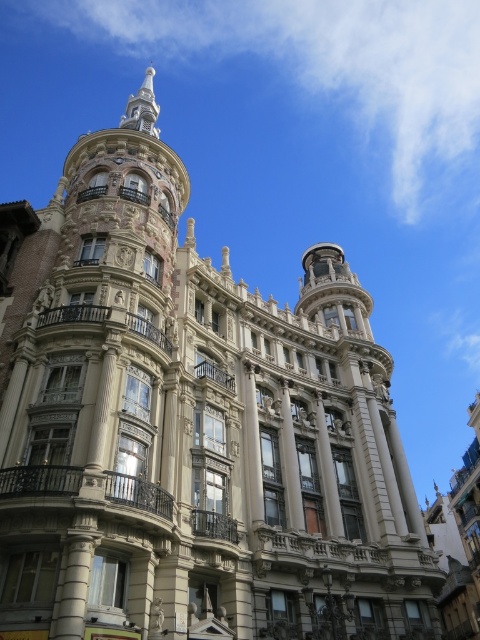
Does white marble column at center have a lesser width compared to brown polished stone pillar at center?

Correct, white marble column at center's width is less than brown polished stone pillar at center's.

Is white marble column at center positioned in front of brown polished stone pillar at center?

Yes, white marble column at center is closer to the viewer.

I want to click on white marble column at center, so click(252, 444).

At what (x,y) coordinates should I click in order to perform the action: click on white marble column at center. Please return your answer as a coordinate pair (x, y). This screenshot has height=640, width=480. Looking at the image, I should click on (252, 444).

Is brown polished stone pillar at center above smooth stone pillar at center?

Yes.

Who is positioned more to the right, brown polished stone pillar at center or smooth stone pillar at center?

From the viewer's perspective, smooth stone pillar at center appears more on the right side.

Between point (300, 484) and point (317, 429), which one is positioned in front?

Positioned in front is point (300, 484).

At what (x,y) coordinates should I click in order to perform the action: click on brown polished stone pillar at center. Please return your answer as a coordinate pair (x, y). Image resolution: width=480 pixels, height=640 pixels. Looking at the image, I should click on (290, 461).

Can you confirm if white marble column at center is smaller than smooth stone pillar at center?

No.

Does point (255, 468) lie in front of point (336, 536)?

Yes, it is in front of point (336, 536).

Where is `white marble column at center`? The width and height of the screenshot is (480, 640). white marble column at center is located at coordinates (252, 444).

Find the location of `white marble column at center`. white marble column at center is located at coordinates (252, 444).